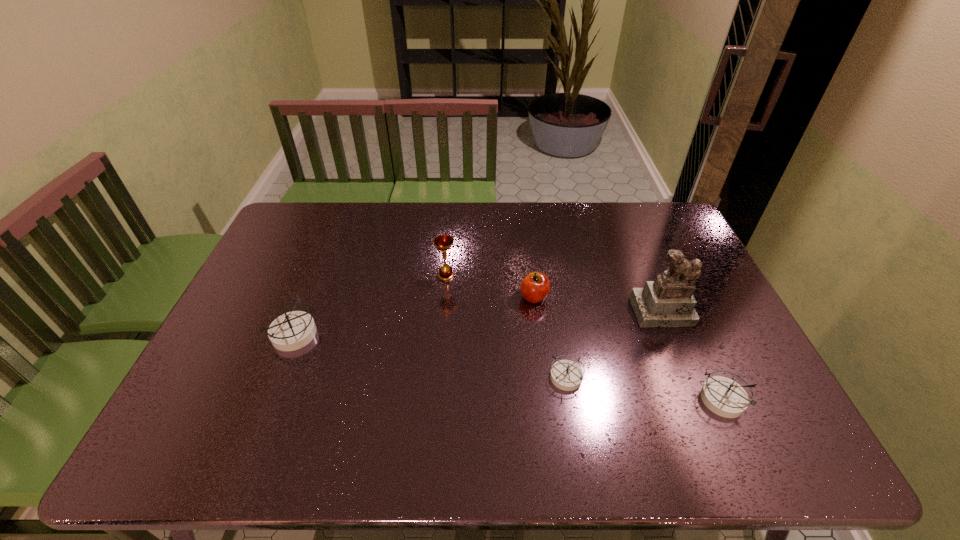
This screenshot has width=960, height=540. In order to click on vacant space that satisfies the following two spatial constraints: 1. on the front side of the second shortest compass; 2. on the right side of the chalice in this screenshot , I will do `click(436, 399)`.

Locate an element on the screen. The image size is (960, 540). blank area in the image that satisfies the following two spatial constraints: 1. on the front-facing side of the tallest object; 2. on the right side of the fifth tallest object is located at coordinates (699, 399).

Identify the location of free spot that satisfies the following two spatial constraints: 1. on the back side of the apple; 2. on the right side of the farthest compass. (308, 297).